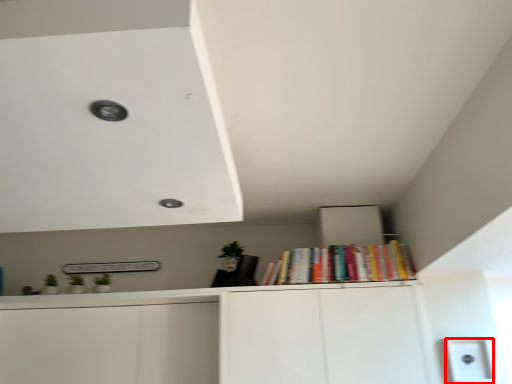
Question: From the image's perspective, what is the correct spatial relationship of light switch (annotated by the red box) in relation to book?

Choices:
 (A) above
 (B) below

Answer: (B)